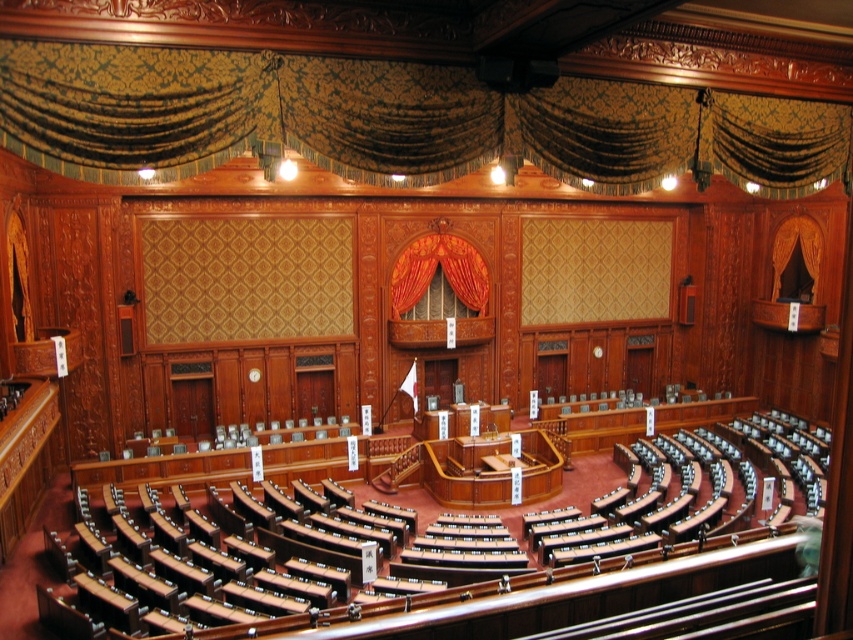
What do you see at coordinates (392, 120) in the screenshot?
I see `gold damask curtain at upper center` at bounding box center [392, 120].

In the scene shown: Who is more forward, (439,120) or (483,305)?

Positioned in front is point (439,120).

Where is `gold damask curtain at upper center`? This screenshot has height=640, width=853. gold damask curtain at upper center is located at coordinates (392, 120).